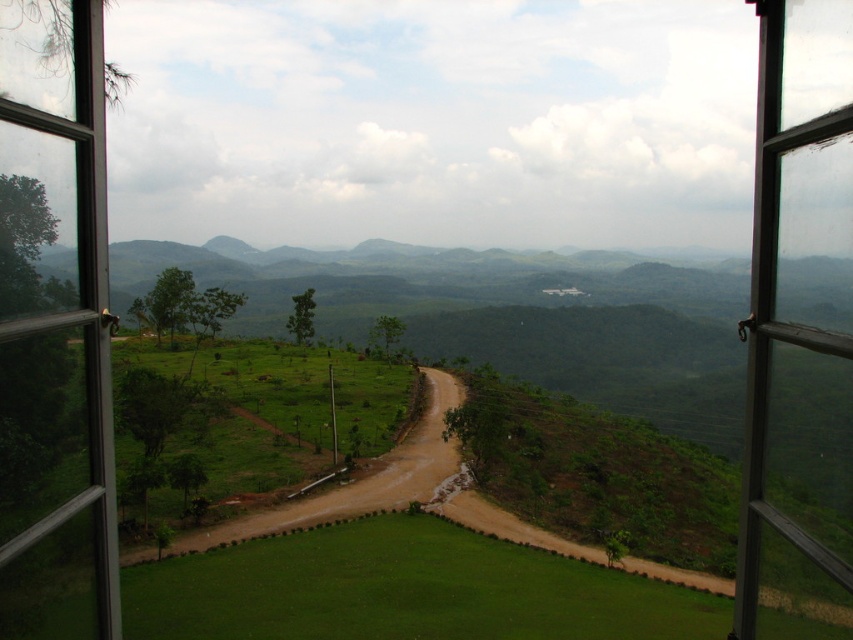
Question: Can you confirm if clear glass window at left is positioned below clear glass window at right?

Choices:
 (A) yes
 (B) no

Answer: (A)

Question: Considering the real-world distances, which object is farthest from the clear glass window at right?

Choices:
 (A) clear glass window at left
 (B) brown dirt track at lower left

Answer: (B)

Question: Which point is farther from the camera taking this photo?

Choices:
 (A) (64, 248)
 (B) (833, 38)

Answer: (A)

Question: Can you confirm if clear glass window at left is positioned above clear glass window at right?

Choices:
 (A) yes
 (B) no

Answer: (B)

Question: Does clear glass window at left have a lesser width compared to brown dirt track at lower left?

Choices:
 (A) no
 (B) yes

Answer: (B)

Question: Among these objects, which one is nearest to the camera?

Choices:
 (A) clear glass window at left
 (B) brown dirt track at lower left

Answer: (A)